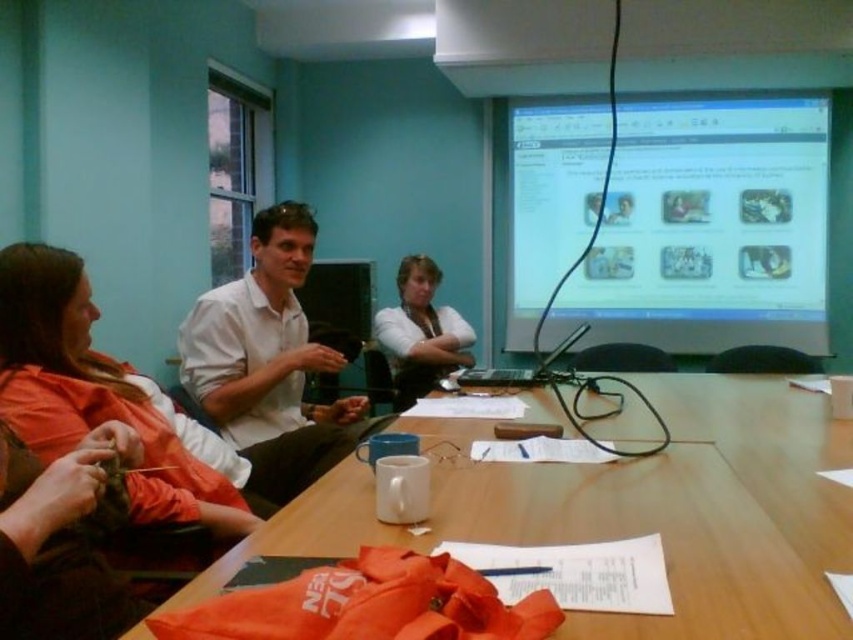
You are standing in the meeting room and want to reach the matte plastic computer screen at upper right. If your arm can extend 1.2 meters, can you reach it without moving closer?

The matte plastic computer screen at upper right is 4.16 meters away from you, which is farther than your arm can reach. You need to move closer to reach it.

You are a person sitting at the meeting table. You need to place a new folder between the matte plastic computer screen at upper right and the orange fabric at left. Which object should you place the folder closer to so it doesn

The folder should be placed closer to the orange fabric at left because the matte plastic computer screen at upper right is taller than the orange fabric at left, meaning the orange fabric is shorter and likely lower in height, allowing space between them where the folder can be positioned nearer to the lower object.